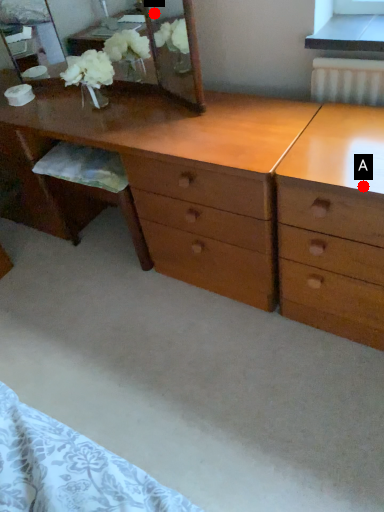
Question: Two points are circled on the image, labeled by A and B beside each circle. Among these points, which one is nearest to the camera?

Choices:
 (A) A is closer
 (B) B is closer

Answer: (A)